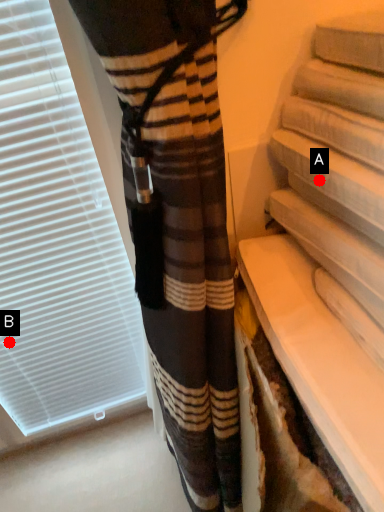
Question: Two points are circled on the image, labeled by A and B beside each circle. Which of the following is the farthest from the observer?

Choices:
 (A) A is further
 (B) B is further

Answer: (B)